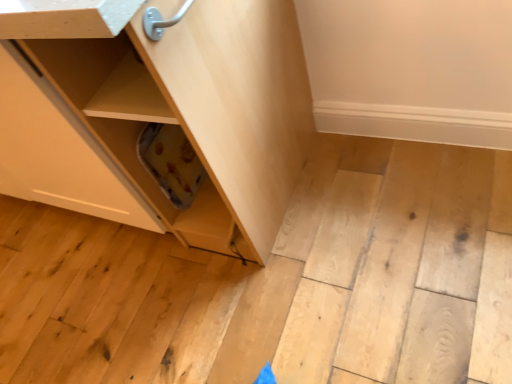
Locate an element on the screen. This screenshot has width=512, height=384. matte wood cabinet at lower left is located at coordinates (193, 106).

This screenshot has height=384, width=512. What do you see at coordinates (193, 106) in the screenshot?
I see `matte wood cabinet at lower left` at bounding box center [193, 106].

Where is `matte wood cabinet at lower left`? Image resolution: width=512 pixels, height=384 pixels. matte wood cabinet at lower left is located at coordinates (193, 106).